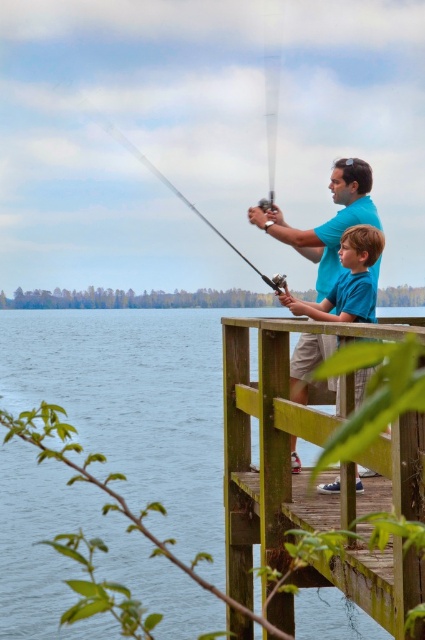
Question: Estimate the real-world distances between objects in this image. Which object is closer to the silver metallic fishing pole at upper center?

Choices:
 (A) blue water at center
 (B) blue matte shirt at center
 (C) wooden dock at center
 (D) shiny metallic fishing pole at center

Answer: (D)

Question: Which object is positioned farthest from the shiny metallic fishing pole at center?

Choices:
 (A) blue matte shirt at center
 (B) wooden dock at center
 (C) silver metallic fishing pole at upper center

Answer: (B)

Question: Can you confirm if wooden dock at center is positioned to the right of shiny metallic fishing pole at center?

Choices:
 (A) no
 (B) yes

Answer: (B)

Question: Which point appears closest to the camera in this image?

Choices:
 (A) (243, 419)
 (B) (274, 58)

Answer: (A)

Question: Can you confirm if wooden dock at center is positioned to the left of shiny metallic fishing pole at center?

Choices:
 (A) no
 (B) yes

Answer: (A)

Question: Is silver metallic fishing pole at upper center thinner than shiny metallic fishing pole at center?

Choices:
 (A) yes
 (B) no

Answer: (A)